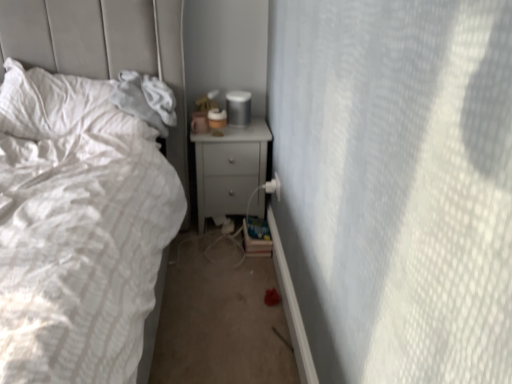
Question: Is matte gray nightstand at center not near matte plastic cup at upper right?

Choices:
 (A) no
 (B) yes

Answer: (A)

Question: From a real-world perspective, is matte gray nightstand at center located beneath matte plastic cup at upper right?

Choices:
 (A) no
 (B) yes

Answer: (B)

Question: Is matte gray nightstand at center aimed at matte plastic cup at upper right?

Choices:
 (A) yes
 (B) no

Answer: (B)

Question: Is matte gray nightstand at center not inside matte plastic cup at upper right?

Choices:
 (A) yes
 (B) no

Answer: (A)

Question: From a real-world perspective, is matte gray nightstand at center over matte plastic cup at upper right?

Choices:
 (A) no
 (B) yes

Answer: (A)

Question: From the image's perspective, does matte gray nightstand at center appear higher than matte plastic cup at upper right?

Choices:
 (A) no
 (B) yes

Answer: (A)

Question: Is matte plastic cup at upper right located outside matte gray nightstand at center?

Choices:
 (A) yes
 (B) no

Answer: (A)

Question: Does matte plastic cup at upper right have a lesser height compared to matte gray nightstand at center?

Choices:
 (A) no
 (B) yes

Answer: (B)

Question: From a real-world perspective, is matte plastic cup at upper right on matte gray nightstand at center?

Choices:
 (A) no
 (B) yes

Answer: (B)

Question: Can you confirm if matte plastic cup at upper right is bigger than matte gray nightstand at center?

Choices:
 (A) yes
 (B) no

Answer: (B)

Question: From a real-world perspective, is matte plastic cup at upper right under matte gray nightstand at center?

Choices:
 (A) no
 (B) yes

Answer: (A)

Question: Does matte plastic cup at upper right have a greater width compared to matte gray nightstand at center?

Choices:
 (A) no
 (B) yes

Answer: (A)

Question: Is white textured pillow at left positioned before matte plastic cup at upper right?

Choices:
 (A) yes
 (B) no

Answer: (A)